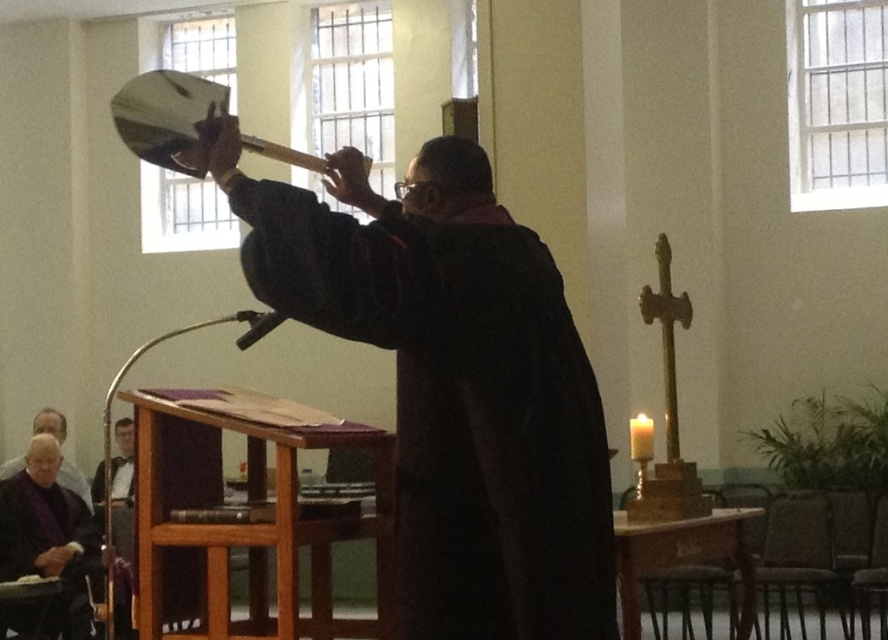
You are an event planner arranging a ceremony in this space. You need to place a 15 feet long table between the black velvet robe at center and the purple velvet robe at lower left. Will the table fit without overlapping either robe?

The black velvet robe at center and purple velvet robe at lower left are 17.73 feet apart. A 15 feet long table can be placed between them without overlapping since 15 feet is shorter than the 17.73 feet distance between the robes.

You are an attendee at this religious ceremony and want to approach the podium. From your current position near the purple velvet robe at lower left, which direction should you move to reach the brown wooden podium at lower center?

The brown wooden podium at lower center is to the right of the purple velvet robe at lower left, so you should move to your right to reach it.

You are an assistant in the church and need to arrange the robes properly. The black velvet robe at center and the purple velvet robe at lower left must be placed according to their current positions. Which robe is positioned to the right side of the other?

The black velvet robe at center is to the right of the purple velvet robe at lower left.